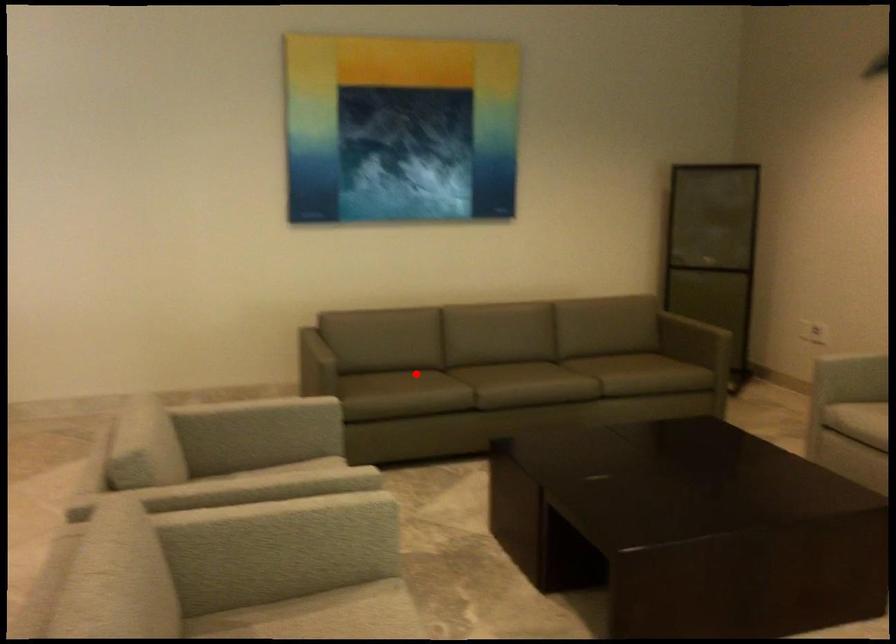
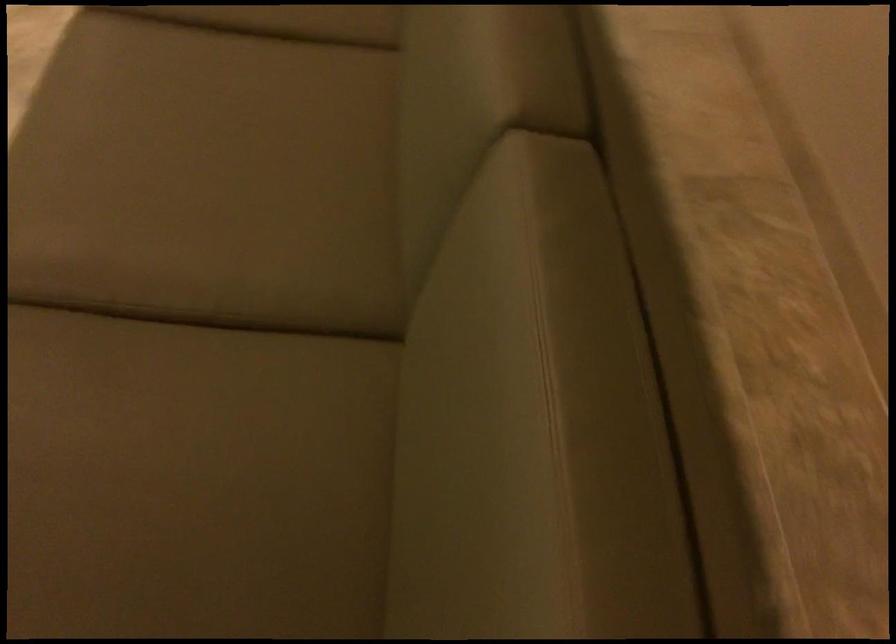
Question: A red point is marked in image1. In image2, is the corresponding 3D point closer to the camera or farther? Reply with the corresponding letter.

Choices:
 (A) The corresponding 3D point is closer.
 (B) The corresponding 3D point is farther.

Answer: (A)